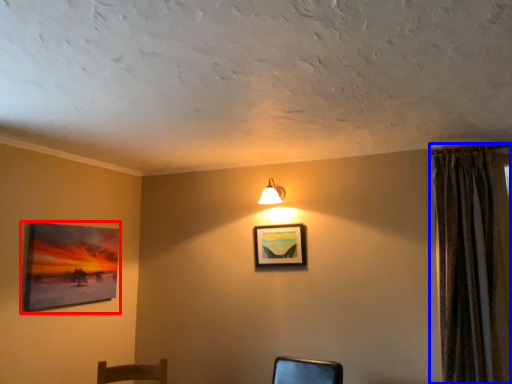
Question: Which object appears farthest to the camera in this image, picture frame (highlighted by a red box) or curtain (highlighted by a blue box)?

Choices:
 (A) picture frame
 (B) curtain

Answer: (A)